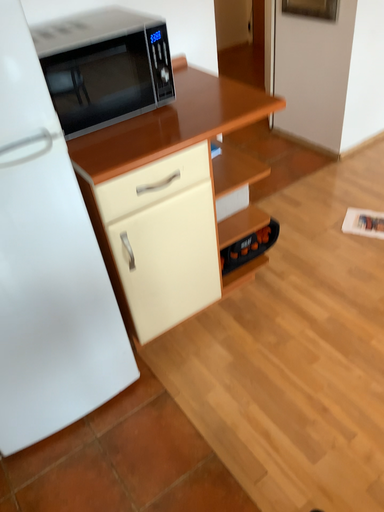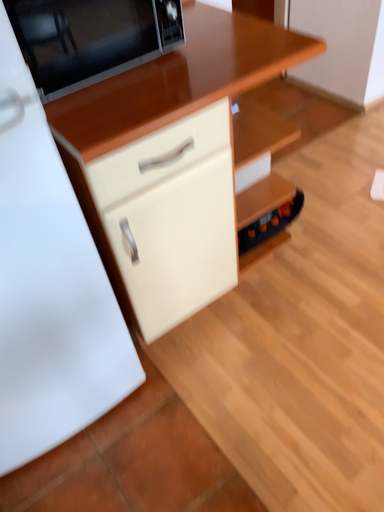
Question: How did the camera likely rotate when shooting the video?

Choices:
 (A) rotated upward
 (B) rotated downward

Answer: (B)